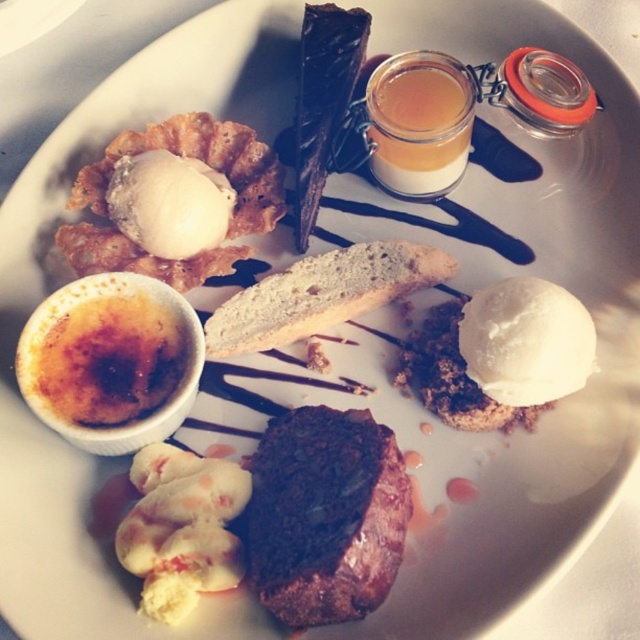
You are a dessert chef preparing a new dish. You have a limited space on the plate and need to arrange the white crumbly biscotti at center and the white creamy ice cream at upper left. Which item requires more horizontal space due to its size?

The white crumbly biscotti at center requires more horizontal space because its width is larger than the white creamy ice cream at upper left.

You are a dessert chef arranging a plate for a photo shoot. You have a white crumbly biscotti at center and a white creamy ice cream at upper left. According to the image, where should you place the biscotti relative to the ice cream to match the scene?

The white crumbly biscotti at center should be placed on the right side of the white creamy ice cream at upper left to match the scene.

You are a dessert lover who wants to take a bite of the dark chocolate cake at center without knocking over the translucent glass jar at upper center. Based on the scene, which object is taller and requires more careful handling?

The dark chocolate cake at center is much taller than the translucent glass jar at upper center, so it requires more careful handling to avoid tipping over the jar.